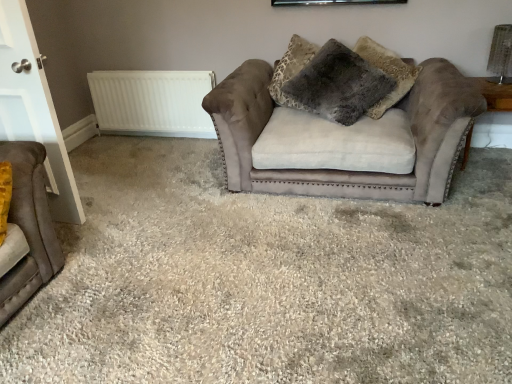
Question: Does white matte radiator at upper left lie behind velvet brown studio couch at left, the 1th studio couch when ordered from left to right?

Choices:
 (A) no
 (B) yes

Answer: (B)

Question: Is white matte radiator at upper left turned away from velvet brown studio couch at left, marked as the 2th studio couch in a back-to-front arrangement?

Choices:
 (A) no
 (B) yes

Answer: (A)

Question: Is white matte radiator at upper left positioned far away from velvet brown studio couch at left, the 1th studio couch positioned from the front?

Choices:
 (A) yes
 (B) no

Answer: (A)

Question: Can you confirm if white matte radiator at upper left is positioned to the right of velvet brown studio couch at left, positioned as the 2th studio couch in right-to-left order?

Choices:
 (A) no
 (B) yes

Answer: (B)

Question: From a real-world perspective, is white matte radiator at upper left positioned over velvet brown studio couch at left, the 1th studio couch when ordered from left to right, based on gravity?

Choices:
 (A) yes
 (B) no

Answer: (B)

Question: Is white matte radiator at upper left taller than velvet brown studio couch at left, marked as the 2th studio couch in a back-to-front arrangement?

Choices:
 (A) yes
 (B) no

Answer: (B)

Question: Is white glossy door at left facing towards white matte radiator at upper left?

Choices:
 (A) no
 (B) yes

Answer: (B)

Question: Is white glossy door at left outside of white matte radiator at upper left?

Choices:
 (A) no
 (B) yes

Answer: (B)

Question: Is white glossy door at left behind white matte radiator at upper left?

Choices:
 (A) yes
 (B) no

Answer: (B)

Question: Considering the relative positions of white glossy door at left and white matte radiator at upper left in the image provided, is white glossy door at left to the left of white matte radiator at upper left from the viewer's perspective?

Choices:
 (A) yes
 (B) no

Answer: (A)

Question: Is white matte radiator at upper left inside white glossy door at left?

Choices:
 (A) yes
 (B) no

Answer: (B)

Question: From the image's perspective, is white glossy door at left below white matte radiator at upper left?

Choices:
 (A) yes
 (B) no

Answer: (A)

Question: Is wooden side table at right next to white glossy door at left and touching it?

Choices:
 (A) no
 (B) yes

Answer: (A)